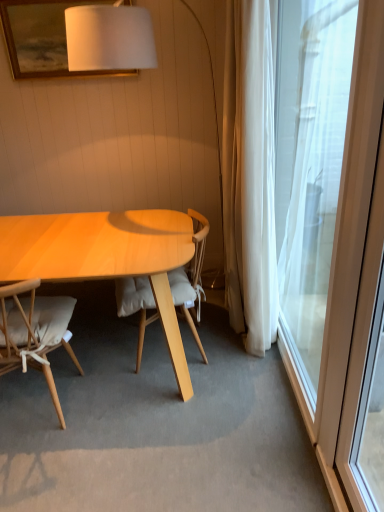
I want to click on free space in front of light wood/wooden chair at center, the 2th chair in the left-to-right sequence, so 164,413.